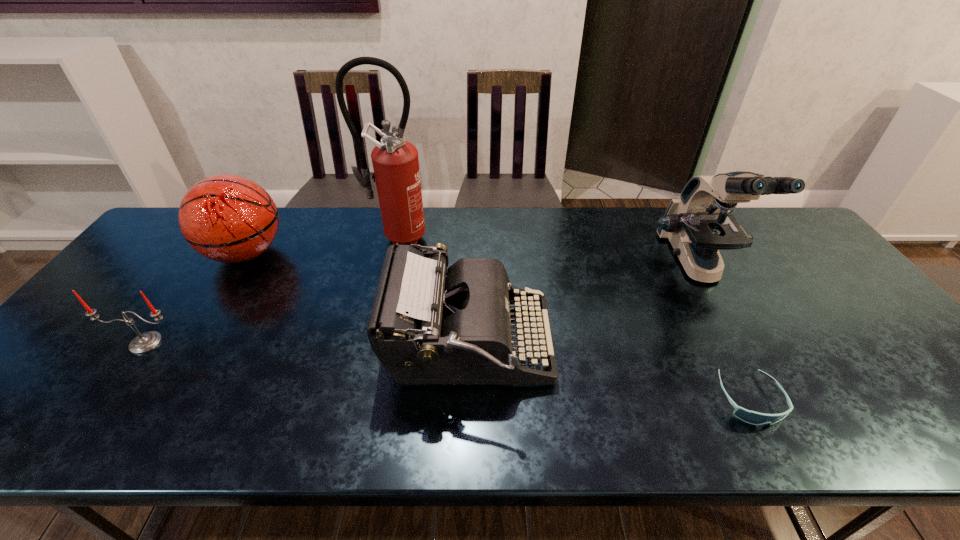
You are a GUI agent. You are given a task and a screenshot of the screen. Output one action in this format:
    pyautogui.click(x=<x>, y=<y>)
    Task: Click on the free location located 0.180m on the front-facing side of the candle
    This screenshot has width=960, height=540.
    Given the screenshot: What is the action you would take?
    pyautogui.click(x=88, y=423)

Identify the location of fire extinguisher present at the far edge. The width and height of the screenshot is (960, 540). (x=395, y=161).

The image size is (960, 540). I want to click on microscope that is at the far edge, so (698, 224).

You are a GUI agent. You are given a task and a screenshot of the screen. Output one action in this format:
    pyautogui.click(x=<x>, y=<y>)
    Task: Click on the basketball at the far edge
    The image size is (960, 540).
    Given the screenshot: What is the action you would take?
    pyautogui.click(x=227, y=218)

Locate an element on the screen. This screenshot has height=540, width=960. typewriter located in the near edge section of the desktop is located at coordinates (429, 325).

Identify the location of goggles that is at the near edge. The width and height of the screenshot is (960, 540). (751, 417).

Identify the location of object that is at the left edge. Image resolution: width=960 pixels, height=540 pixels. (145, 342).

Locate an element on the screen. free space at the far edge of the desktop is located at coordinates (545, 237).

Identify the location of free space at the near edge of the desktop. (544, 425).

Where is `vacant region at the left edge of the desktop`? This screenshot has width=960, height=540. vacant region at the left edge of the desktop is located at coordinates (59, 361).